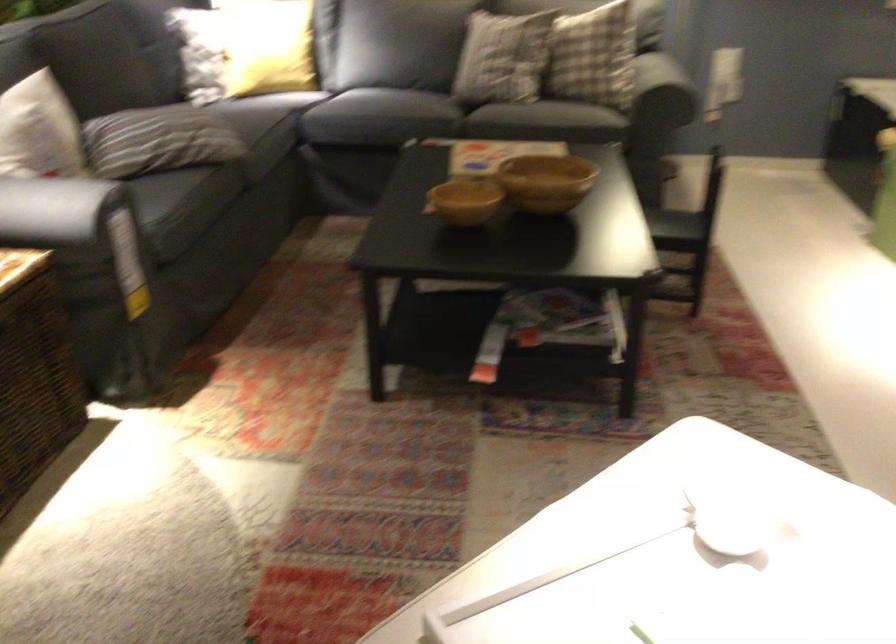
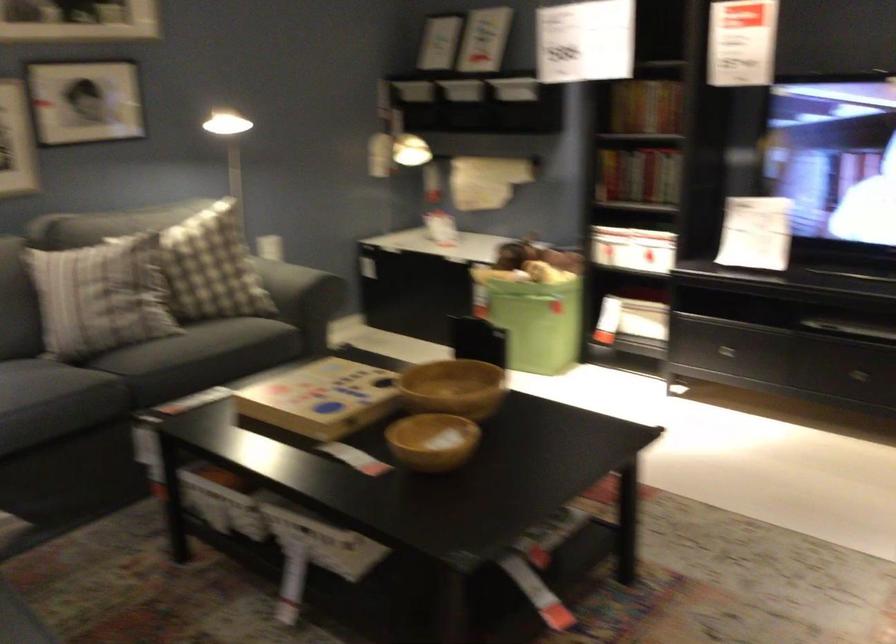
In the second image, find the point that corresponds to pixel 617 73 in the first image.

(286, 285)